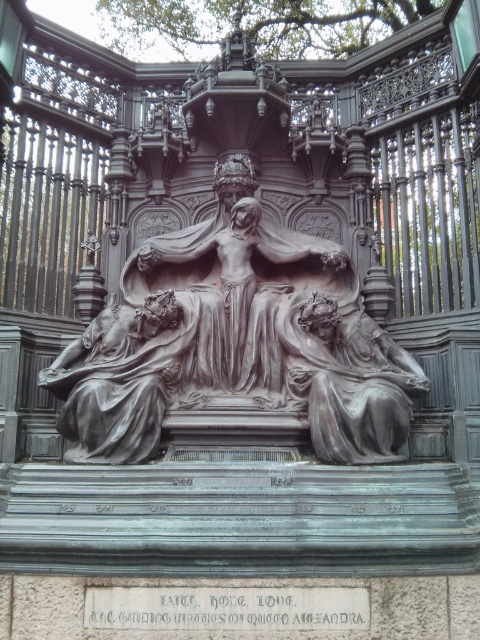
Question: Which object is the farthest from the polished bronze sculpture at center?

Choices:
 (A) polished bronze statue at center
 (B) matte bronze statue at center

Answer: (B)

Question: Does polished bronze sculpture at center appear on the right side of polished bronze statue at center?

Choices:
 (A) no
 (B) yes

Answer: (B)

Question: Is polished bronze sculpture at center thinner than matte bronze statue at center?

Choices:
 (A) no
 (B) yes

Answer: (A)

Question: Which object is closer to the camera taking this photo?

Choices:
 (A) matte bronze statue at center
 (B) polished bronze sculpture at center

Answer: (A)

Question: Does polished bronze sculpture at center lie behind polished bronze statue at center?

Choices:
 (A) yes
 (B) no

Answer: (A)

Question: Which of these objects is positioned closest to the polished bronze sculpture at center?

Choices:
 (A) matte bronze statue at center
 (B) polished bronze statue at center

Answer: (B)